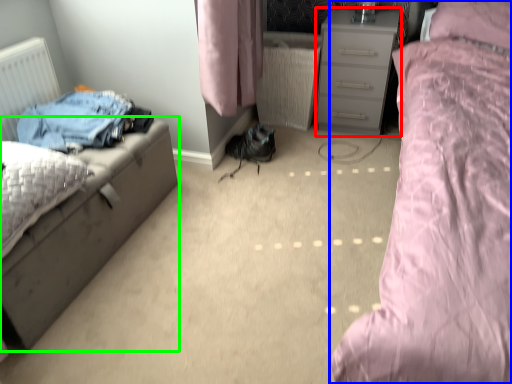
Question: Which object is positioned farthest from chest of drawers (highlighted by a red box)? Select from bed (highlighted by a blue box) and nightstand (highlighted by a green box).

Choices:
 (A) bed
 (B) nightstand

Answer: (B)